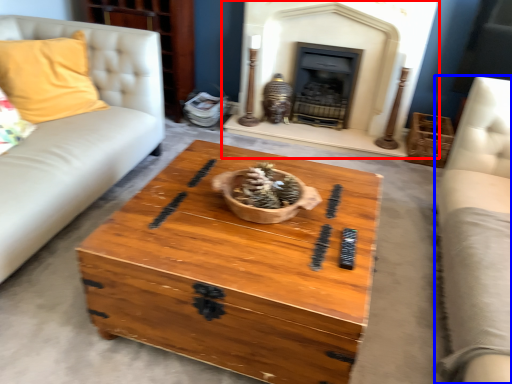
Question: Among these objects, which one is farthest to the camera, fireplace (highlighted by a red box) or couch (highlighted by a blue box)?

Choices:
 (A) fireplace
 (B) couch

Answer: (A)